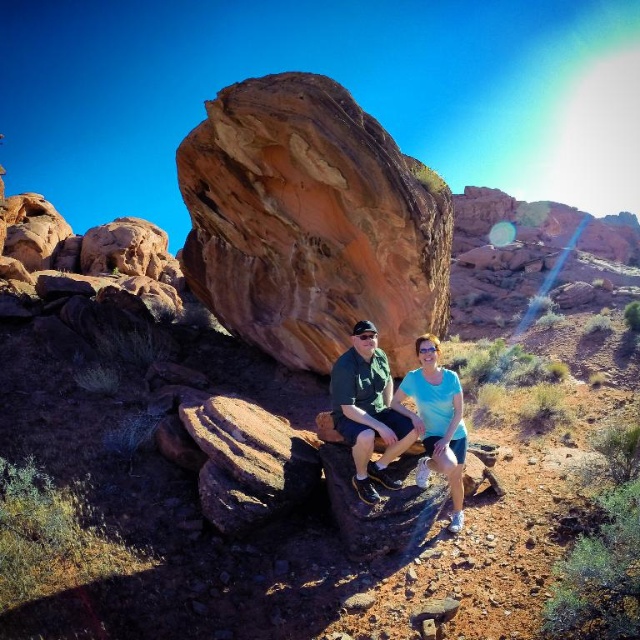
Between rustic sandstone rock at center and matte green shorts at center, which one appears on the left side from the viewer's perspective?

From the viewer's perspective, rustic sandstone rock at center appears more on the left side.

Can you confirm if rustic sandstone rock at center is bigger than matte green shorts at center?

No.

This screenshot has width=640, height=640. What do you see at coordinates (310, 221) in the screenshot?
I see `rustic sandstone rock at center` at bounding box center [310, 221].

Identify the location of rustic sandstone rock at center. (310, 221).